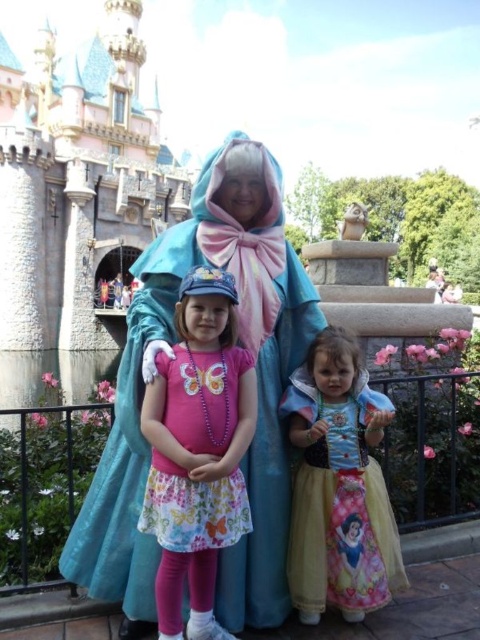
Question: Is stone castle at center wider than pink fabric dress at center?

Choices:
 (A) yes
 (B) no

Answer: (A)

Question: Which of the following is the closest to the observer?

Choices:
 (A) tap(240, 582)
 (B) tap(312, 604)
 (C) tap(128, 298)

Answer: (B)

Question: Which of the following is the closest to the observer?

Choices:
 (A) (277, 284)
 (B) (186, 275)
 (C) (25, 346)

Answer: (B)

Question: Which object appears farthest from the camera in this image?

Choices:
 (A) turquoise satin cape at center
 (B) yellow satin dress at center

Answer: (B)

Question: Can you confirm if turquoise satin cape at center is positioned to the right of pink fabric dress at center?

Choices:
 (A) yes
 (B) no

Answer: (A)

Question: Can you confirm if stone castle at center is positioned to the left of pink fabric dress at center?

Choices:
 (A) no
 (B) yes

Answer: (B)